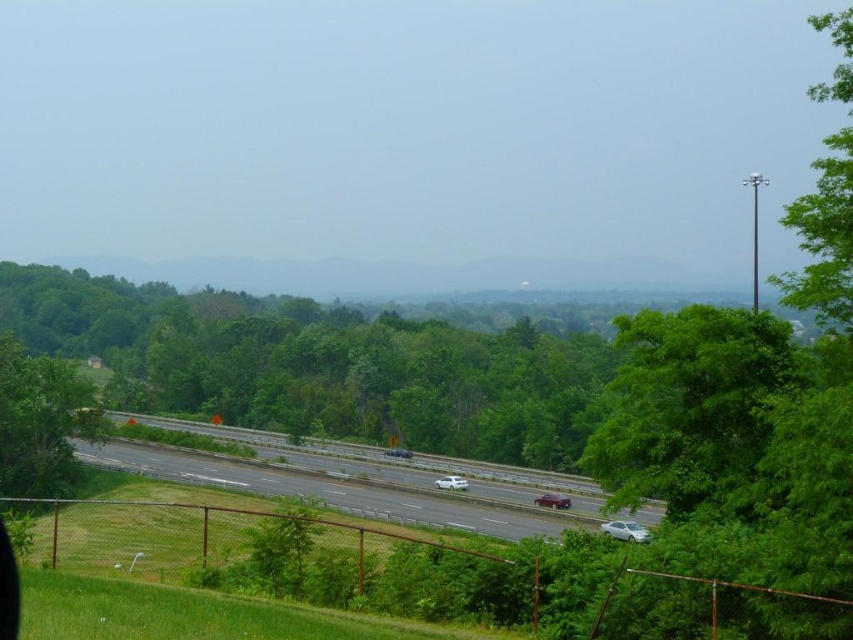
You are a drone operator trying to capture a photo of the green leafy tree at center and the gray asphalt highway at center. From your current position, which object is closer to the left side of the frame?

The green leafy tree at center is positioned on the left side of the gray asphalt highway at center, so it is closer to the left side of the frame.

You are a drone operator trying to capture a photo of the green leafy tree at center and the gray asphalt highway at center. From your current position above the scene, can you see both objects clearly at the same time?

The green leafy tree at center is positioned over the gray asphalt highway at center, so the tree may block part of the highway in the photo, making it difficult to see both clearly at the same time.